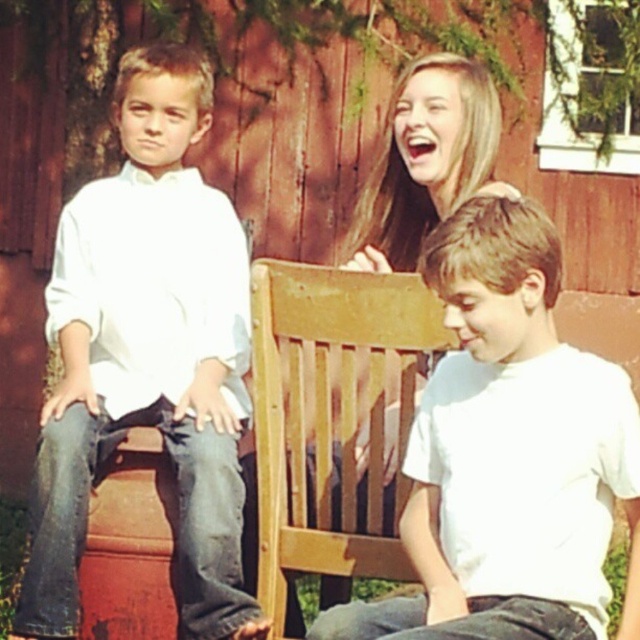
You are a photographer setting up for a group photo. You have two subjects wearing the matte white shirt at left and white matte shirt at center. The camera you are using has a depth of field that can focus clearly on subjects within a 1 meter range. Will both subjects be in focus if you focus on the center subject?

The distance between the matte white shirt at left and white matte shirt at center is 1.10 meters. Since the depth of field can only focus within 1 meter, the subject at left will be slightly out of focus.

You are a photographer standing at the camera position. You want to capture a closeup shot of the matte white shirt at left. The camera has a minimum focusing distance of 10 feet. Can you take the photo without moving closer?

The matte white shirt at left and camera are 10.93 feet apart from each other. Since the minimum focusing distance is 10 feet, the camera can focus on the matte white shirt at left from this distance, so yes, you can take the photo without moving closer.

You are standing in front of the red wooden wall and want to take a photo of both the point at coordinates point (246, 602) and point (454, 394). Which point should you focus on first to ensure both are in focus?

You should focus on point (246, 602) first because it is closer to the camera than point (454, 394), ensuring both will be in focus when using depth of field.